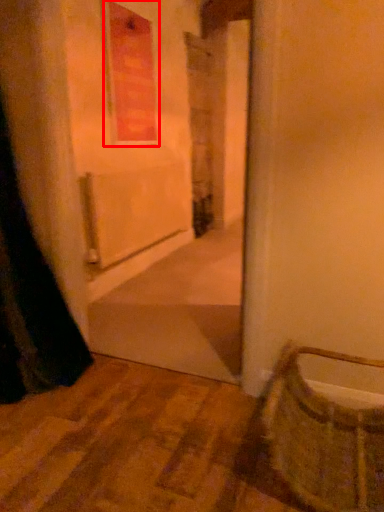
Question: From the image's perspective, considering the relative positions of window (annotated by the red box) and basket in the image provided, where is window (annotated by the red box) located with respect to the staircase?

Choices:
 (A) above
 (B) below

Answer: (A)